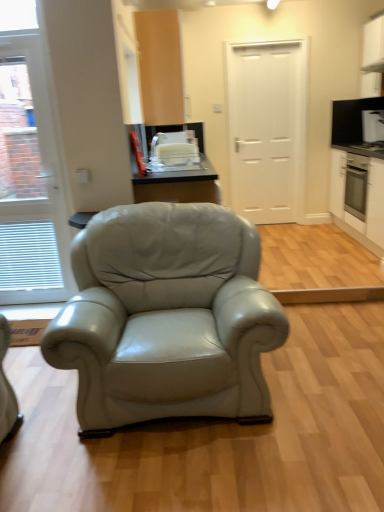
What do you see at coordinates (160, 66) in the screenshot?
I see `matte wood cabinet at upper center, which is the 3th cabinetry in right-to-left order` at bounding box center [160, 66].

This screenshot has width=384, height=512. In order to click on white glossy cabinet at right, the 1th cabinetry positioned from the right in this screenshot , I will do `click(357, 174)`.

This screenshot has height=512, width=384. What do you see at coordinates (351, 119) in the screenshot?
I see `white glossy microwave at upper right, the 2th appliance in the left-to-right sequence` at bounding box center [351, 119].

Describe the element at coordinates (267, 129) in the screenshot. I see `white matte door at center, acting as the second door starting from the front` at that location.

Where is `white glossy toaster at upper center, which ranks as the 1th appliance in front-to-back order`? white glossy toaster at upper center, which ranks as the 1th appliance in front-to-back order is located at coordinates (175, 149).

Can you confirm if white glossy door at left, the 2th door viewed from the right, is thinner than white glossy microwave at upper right, which ranks as the first appliance in top-to-bottom order?

No, white glossy door at left, the 2th door viewed from the right, is not thinner than white glossy microwave at upper right, which ranks as the first appliance in top-to-bottom order.

Identify the location of appliance that is the 2nd one above the white glossy door at left, marked as the 2th door in a back-to-front arrangement (from a real-world perspective). click(351, 119).

Which is further, [54,189] or [383,102]?

The point [383,102] is behind.

From the image's perspective, between white glossy door at left, the 1th door from the left, and white glossy microwave at upper right, the 2th appliance positioned from the front, who is located below?

From the image's view, white glossy door at left, the 1th door from the left, is below.

From the image's perspective, relative to matte wood cabinet at upper center, which is the 3th cabinetry in right-to-left order, is white glossy door at left, marked as the 2th door in a back-to-front arrangement, above or below?

Based on their image positions, white glossy door at left, marked as the 2th door in a back-to-front arrangement, is located beneath matte wood cabinet at upper center, which is the 3th cabinetry in right-to-left order.

Is white glossy door at left, the 2th door viewed from the right, at the right side of matte wood cabinet at upper center, which is counted as the first cabinetry, starting from the left?

No, white glossy door at left, the 2th door viewed from the right, is not to the right of matte wood cabinet at upper center, which is counted as the first cabinetry, starting from the left.

Which point is more forward, (52, 248) or (150, 117)?

Point (52, 248)

This screenshot has width=384, height=512. What are the coordinates of `door on the left of the matte wood cabinet at upper center, which is the 3th cabinetry in right-to-left order` in the screenshot? It's located at (29, 180).

Are white glossy microwave at upper right, the 2th appliance in the left-to-right sequence, and white glossy door at left, the 1th door from the left, far apart?

Indeed, white glossy microwave at upper right, the 2th appliance in the left-to-right sequence, is not near white glossy door at left, the 1th door from the left.

Consider the image. Which object is positioned more to the right, white glossy microwave at upper right, which ranks as the first appliance in top-to-bottom order, or white glossy door at left, marked as the 2th door in a back-to-front arrangement?

white glossy microwave at upper right, which ranks as the first appliance in top-to-bottom order, is more to the right.

Considering the sizes of objects white glossy microwave at upper right, which ranks as the first appliance in top-to-bottom order, and white glossy door at left, the 2th door viewed from the right, in the image provided, who is shorter, white glossy microwave at upper right, which ranks as the first appliance in top-to-bottom order, or white glossy door at left, the 2th door viewed from the right,?

With less height is white glossy microwave at upper right, which ranks as the first appliance in top-to-bottom order.

Can you confirm if white glossy microwave at upper right, the 2th appliance in the left-to-right sequence, is smaller than white glossy door at left, placed as the first door when sorted from front to back?

Indeed, white glossy microwave at upper right, the 2th appliance in the left-to-right sequence, has a smaller size compared to white glossy door at left, placed as the first door when sorted from front to back.

Which point is more distant from viewer, (159, 143) or (383, 205)?

Point (159, 143)

Between white glossy toaster at upper center, acting as the 1th appliance starting from the left, and white glossy cabinet at right, which is the 3th cabinetry in left-to-right order, which one has smaller size?

white glossy toaster at upper center, acting as the 1th appliance starting from the left, is smaller.

Considering the positions of objects white glossy toaster at upper center, which ranks as the 1th appliance in front-to-back order, and white glossy cabinet at right, the 1th cabinetry positioned from the right, in the image provided, who is more to the left, white glossy toaster at upper center, which ranks as the 1th appliance in front-to-back order, or white glossy cabinet at right, the 1th cabinetry positioned from the right,?

white glossy toaster at upper center, which ranks as the 1th appliance in front-to-back order.

Between white glossy toaster at upper center, which is counted as the 2th appliance, starting from the top, and white glossy cabinet at right, which is the 3th cabinetry in left-to-right order, which one has less height?

With less height is white glossy toaster at upper center, which is counted as the 2th appliance, starting from the top.

Considering the relative positions of white matte cabinet at right, marked as the second cabinetry in a left-to-right arrangement, and white matte door at center, acting as the second door starting from the front, in the image provided, is white matte cabinet at right, marked as the second cabinetry in a left-to-right arrangement, to the right of white matte door at center, acting as the second door starting from the front, from the viewer's perspective?

Yes.

Is white matte cabinet at right, marked as the second cabinetry in a left-to-right arrangement, turned away from white matte door at center, acting as the second door starting from the front?

That's not correct — white matte cabinet at right, marked as the second cabinetry in a left-to-right arrangement, is not looking away from white matte door at center, acting as the second door starting from the front.

Is white matte cabinet at right, marked as the second cabinetry in a left-to-right arrangement, far from white matte door at center, positioned as the 2th door in left-to-right order?

Absolutely, white matte cabinet at right, marked as the second cabinetry in a left-to-right arrangement, is distant from white matte door at center, positioned as the 2th door in left-to-right order.

Is white matte door at center, which is counted as the first door, starting from the right, completely or partially inside white matte cabinet at right, placed as the 2th cabinetry when sorted from right to left?

No, white matte door at center, which is counted as the first door, starting from the right, is located outside of white matte cabinet at right, placed as the 2th cabinetry when sorted from right to left.

From a real-world perspective, is white matte cabinet at right, placed as the 2th cabinetry when sorted from right to left, located higher than matte wood cabinet at upper center, which is counted as the first cabinetry, starting from the left?

No, from a real-world perspective, white matte cabinet at right, placed as the 2th cabinetry when sorted from right to left, is not above matte wood cabinet at upper center, which is counted as the first cabinetry, starting from the left.

Considering the relative positions of white matte cabinet at right, placed as the 2th cabinetry when sorted from right to left, and matte wood cabinet at upper center, which is the 3th cabinetry in right-to-left order, in the image provided, is white matte cabinet at right, placed as the 2th cabinetry when sorted from right to left, to the right of matte wood cabinet at upper center, which is the 3th cabinetry in right-to-left order, from the viewer's perspective?

Correct, you'll find white matte cabinet at right, placed as the 2th cabinetry when sorted from right to left, to the right of matte wood cabinet at upper center, which is the 3th cabinetry in right-to-left order.

Measure the distance from white matte cabinet at right, placed as the 2th cabinetry when sorted from right to left, to matte wood cabinet at upper center, which is the 3th cabinetry in right-to-left order.

The distance of white matte cabinet at right, placed as the 2th cabinetry when sorted from right to left, from matte wood cabinet at upper center, which is the 3th cabinetry in right-to-left order, is 7.09 feet.

Does white matte cabinet at right, placed as the 2th cabinetry when sorted from right to left, have a greater width compared to matte wood cabinet at upper center, which is the 3th cabinetry in right-to-left order?

No, white matte cabinet at right, placed as the 2th cabinetry when sorted from right to left, is not wider than matte wood cabinet at upper center, which is the 3th cabinetry in right-to-left order.

Can you see white glossy cabinet at right, which is the 3th cabinetry in left-to-right order, touching white glossy microwave at upper right, the 1th appliance when ordered from right to left?

No, white glossy cabinet at right, which is the 3th cabinetry in left-to-right order, is not making contact with white glossy microwave at upper right, the 1th appliance when ordered from right to left.

Can you confirm if white glossy cabinet at right, which is the 3th cabinetry in left-to-right order, is taller than white glossy microwave at upper right, the 1th appliance when ordered from right to left?

Indeed, white glossy cabinet at right, which is the 3th cabinetry in left-to-right order, has a greater height compared to white glossy microwave at upper right, the 1th appliance when ordered from right to left.

From the picture: Looking at their sizes, would you say white glossy cabinet at right, the 1th cabinetry positioned from the right, is wider or thinner than white glossy microwave at upper right, which ranks as the first appliance in top-to-bottom order?

In the image, white glossy cabinet at right, the 1th cabinetry positioned from the right, appears to be wider than white glossy microwave at upper right, which ranks as the first appliance in top-to-bottom order.

Is white glossy cabinet at right, which is the 3th cabinetry in left-to-right order, aimed at white glossy microwave at upper right, which ranks as the first appliance in top-to-bottom order?

No, white glossy cabinet at right, which is the 3th cabinetry in left-to-right order, is not oriented towards white glossy microwave at upper right, which ranks as the first appliance in top-to-bottom order.

Identify the location of the 2nd door below when counting from the white glossy microwave at upper right, which is counted as the 1th appliance, starting from the back (from the image's perspective). (29, 180).

Which cabinetry is the 1st one when counting from the right side of the white glossy door at left, the 1th door from the left? Please provide its 2D coordinates.

[(160, 66)]

Estimate the real-world distances between objects in this image. Which object is further from white matte door at center, acting as the second door starting from the front, white glossy door at left, placed as the first door when sorted from front to back, or white glossy toaster at upper center, which is counted as the 2th appliance, starting from the top?

The object further to white matte door at center, acting as the second door starting from the front, is white glossy door at left, placed as the first door when sorted from front to back.

Considering their positions, is white glossy microwave at upper right, the 2th appliance positioned from the front, positioned closer to white matte cabinet at right, placed as the 2th cabinetry when sorted from right to left, than white glossy toaster at upper center, acting as the 1th appliance starting from the left?

white glossy microwave at upper right, the 2th appliance positioned from the front.

Based on their spatial positions, is white glossy door at left, the 1th door from the left, or white glossy microwave at upper right, which ranks as the first appliance in top-to-bottom order, closer to matte wood cabinet at upper center, which is counted as the first cabinetry, starting from the left?

The object closer to matte wood cabinet at upper center, which is counted as the first cabinetry, starting from the left, is white glossy door at left, the 1th door from the left.

Based on the photo, which object lies further to the anchor point white glossy toaster at upper center, which is counted as the 2th appliance, starting from the top, white glossy microwave at upper right, the 1th appliance when ordered from right to left, or white matte cabinet at right, placed as the 2th cabinetry when sorted from right to left?

Among the two, white matte cabinet at right, placed as the 2th cabinetry when sorted from right to left, is located further to white glossy toaster at upper center, which is counted as the 2th appliance, starting from the top.

Based on their spatial positions, is white glossy cabinet at right, which is the 3th cabinetry in left-to-right order, or white matte cabinet at right, placed as the 2th cabinetry when sorted from right to left, further from white glossy toaster at upper center, acting as the 1th appliance starting from the left?

white matte cabinet at right, placed as the 2th cabinetry when sorted from right to left, is positioned further to the anchor white glossy toaster at upper center, acting as the 1th appliance starting from the left.

Consider the image. When comparing their distances from white glossy door at left, marked as the 2th door in a back-to-front arrangement, does white matte door at center, acting as the second door starting from the front, or white matte cabinet at right, marked as the second cabinetry in a left-to-right arrangement, seem closer?

white matte door at center, acting as the second door starting from the front, is closer to white glossy door at left, marked as the 2th door in a back-to-front arrangement.

Which object lies further to the anchor point white glossy microwave at upper right, the 1th appliance when ordered from right to left, white glossy cabinet at right, the 1th cabinetry positioned from the right, or white matte door at center, positioned as the 2th door in left-to-right order?

Based on the image, white matte door at center, positioned as the 2th door in left-to-right order, appears to be further to white glossy microwave at upper right, the 1th appliance when ordered from right to left.

From the image, which object appears to be nearer to white glossy cabinet at right, the 1th cabinetry positioned from the right, matte wood cabinet at upper center, which is counted as the first cabinetry, starting from the left, or white matte cabinet at right, marked as the second cabinetry in a left-to-right arrangement?

white matte cabinet at right, marked as the second cabinetry in a left-to-right arrangement, is positioned closer to the anchor white glossy cabinet at right, the 1th cabinetry positioned from the right.

Find the location of a particular element. The height and width of the screenshot is (512, 384). door situated between white glossy toaster at upper center, which ranks as the 1th appliance in front-to-back order, and white glossy cabinet at right, which is the 3th cabinetry in left-to-right order, from left to right is located at coordinates (267, 129).

Locate an element on the screen. The image size is (384, 512). door situated between white glossy door at left, the 2th door viewed from the right, and white glossy cabinet at right, which is the 3th cabinetry in left-to-right order, from left to right is located at coordinates (267, 129).

Image resolution: width=384 pixels, height=512 pixels. I want to click on door between white glossy door at left, the 2th door viewed from the right, and white glossy microwave at upper right, the 2th appliance in the left-to-right sequence, in the horizontal direction, so click(x=267, y=129).

The image size is (384, 512). Identify the location of door between white glossy toaster at upper center, acting as the 1th appliance starting from the left, and white matte cabinet at right, placed as the 2th cabinetry when sorted from right to left. (267, 129).